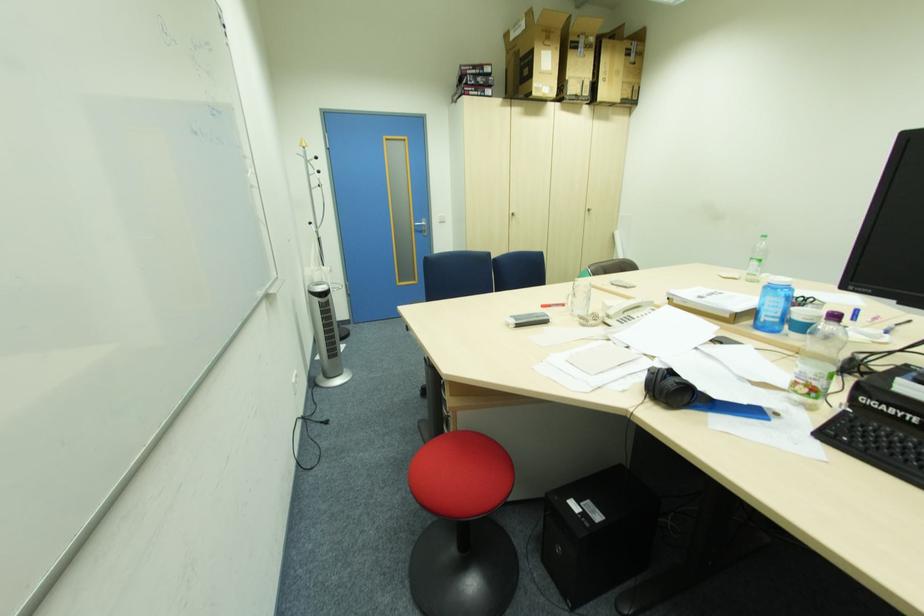
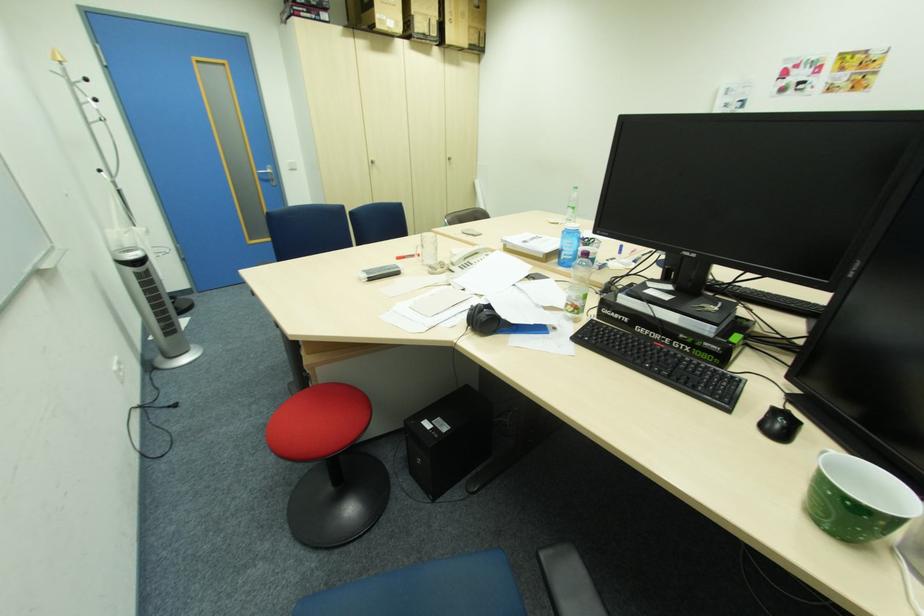
The point at (758,262) is marked in the first image. Where is the corresponding point in the second image?

(574, 209)